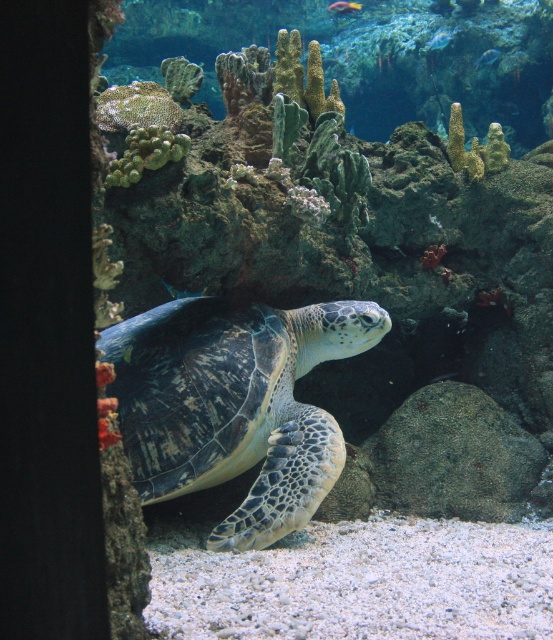
You are a marine biologist diving underwater and want to observe the leathery green turtle at center from a safe distance. The recommended safe distance for observing sea turtles is 6 feet. Can you confirm if you are within the safe distance?

The leathery green turtle at center and viewer are 6.66 feet apart from each other, which is beyond the recommended safe distance of 6 feet. You should move closer to ensure you are within the safe observation range.

You are a marine biologist observing the underwater scene. You notice the translucent blue fish at upper center and the shiny pink fish at center. Which fish is closer to the camera?

The translucent blue fish at upper center is closer to the camera because it is in front of the shiny pink fish at center.

You are a marine biologist observing this underwater scene. You need to determine which object is wider between the leathery green turtle at center and the shiny blue fish at upper center. Which one is wider?

The leathery green turtle at center is wider than the shiny blue fish at upper center according to the description.